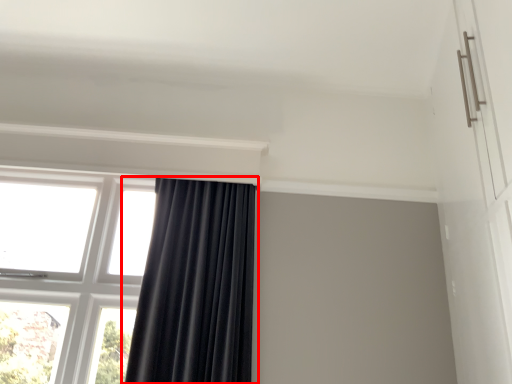
Question: From the image's perspective, where is curtain (annotated by the red box) located relative to window?

Choices:
 (A) below
 (B) above

Answer: (B)